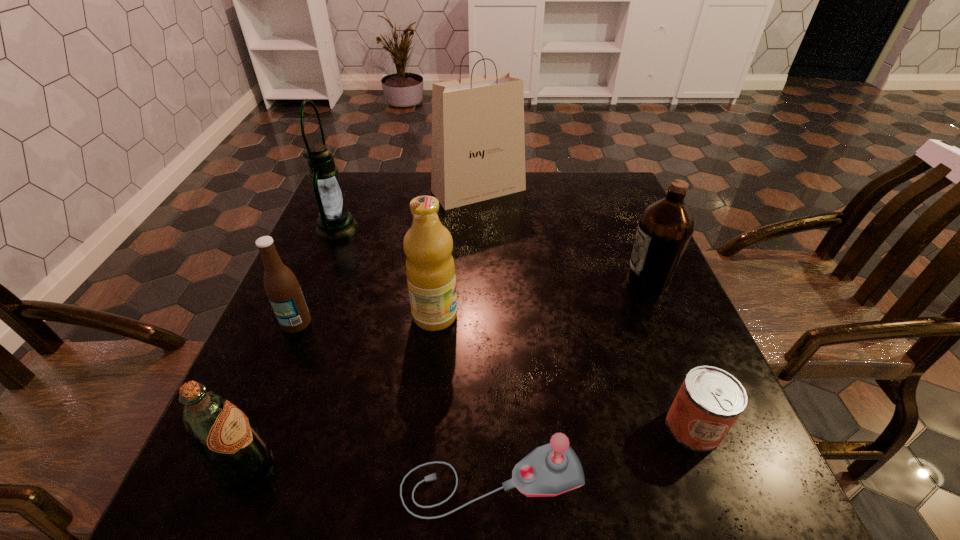
The image size is (960, 540). In order to click on the farthest object in this screenshot , I will do `click(478, 141)`.

Identify the location of lantern. The width and height of the screenshot is (960, 540). (335, 221).

I want to click on the second olive oil from left to right, so click(x=430, y=269).

Find the location of a particular element. This screenshot has height=540, width=960. the rightmost olive oil is located at coordinates (665, 228).

In order to click on the farthest olive oil in this screenshot , I will do `click(665, 228)`.

Where is `beer bottle`? The image size is (960, 540). beer bottle is located at coordinates (282, 288).

Locate an element on the screen. Image resolution: width=960 pixels, height=540 pixels. the shortest olive oil is located at coordinates (233, 451).

The image size is (960, 540). Identify the location of the nearest olive oil. (233, 451).

The height and width of the screenshot is (540, 960). Identify the location of can. (709, 401).

Identify the location of joystick. (552, 469).